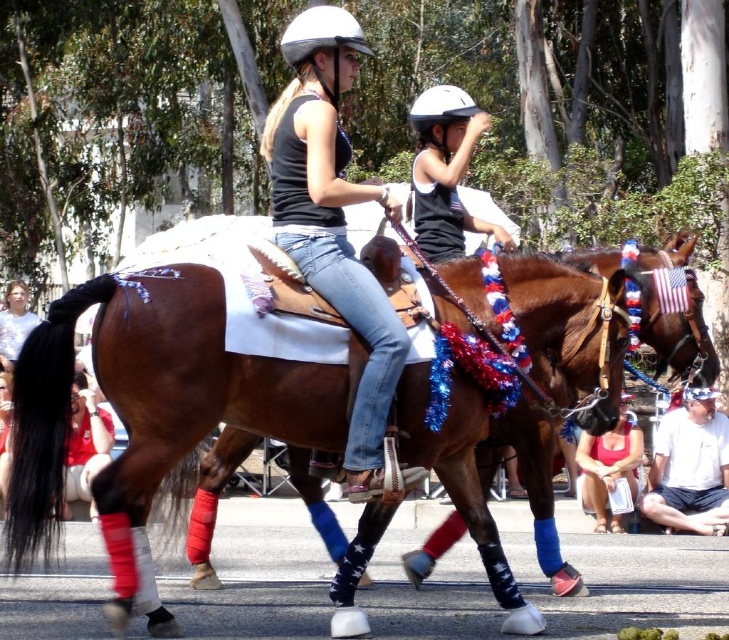
You are a photographer at the event and want to capture both the white cotton shirt at lower right and the matte pink tank top at lower center in the same frame. Which clothing item should you focus on first to ensure both are in the frame?

You should focus on the white cotton shirt at lower right first because it might be wider than the matte pink tank top at lower center, so centering on it would ensure both fit within the frame.